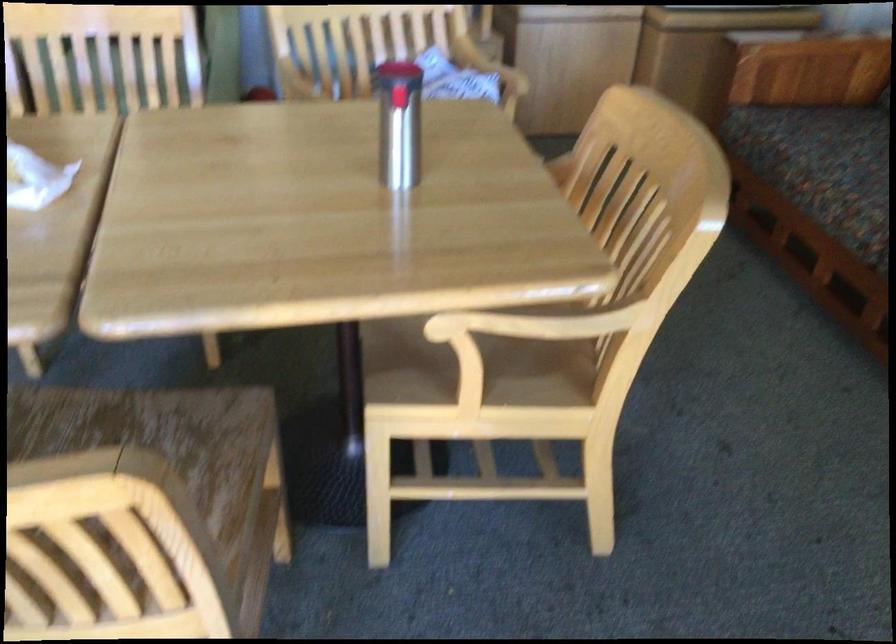
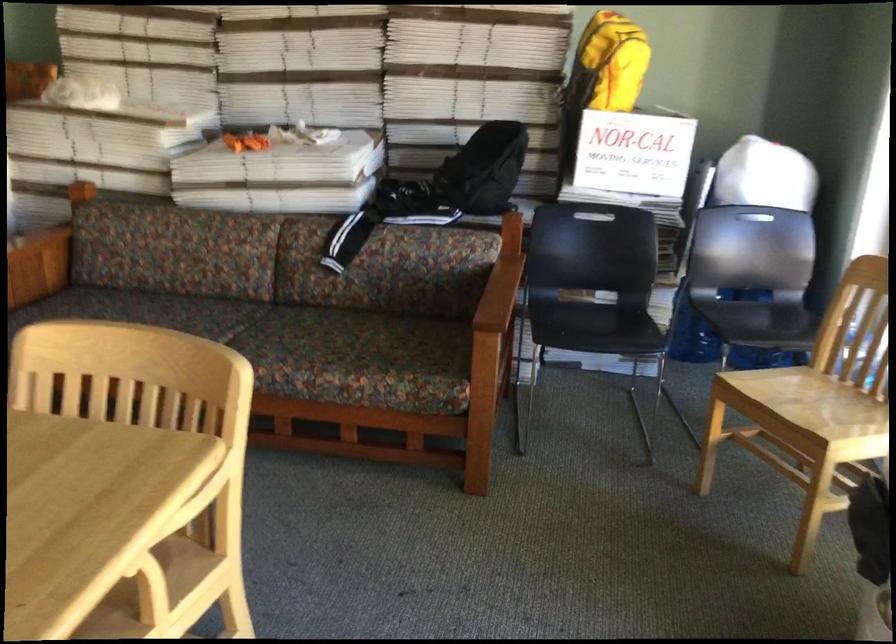
Question: The camera is either moving clockwise (left) or counter-clockwise (right) around the object. The first image is from the beginning of the video and the second image is from the end. Is the camera moving left or right when shooting the video?

Choices:
 (A) Left
 (B) Right

Answer: (A)